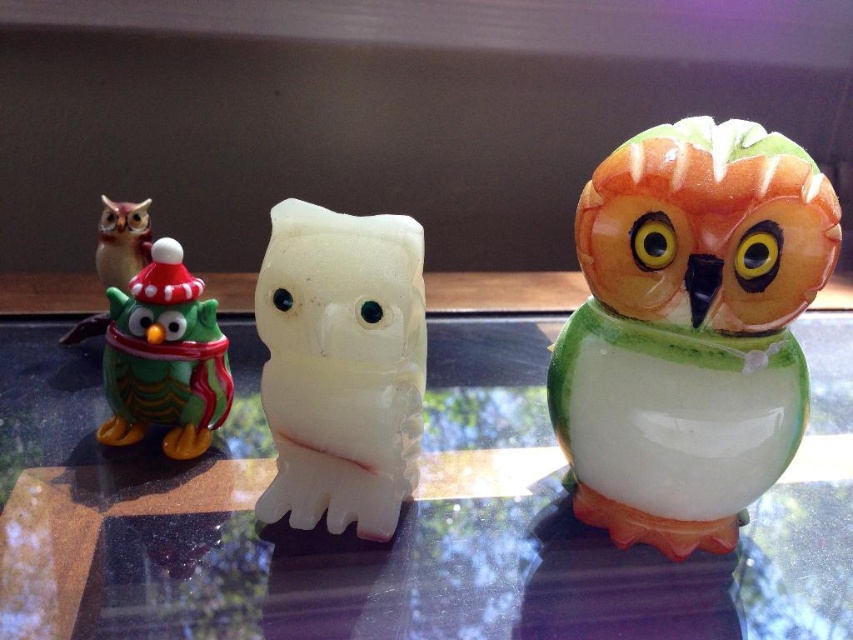
You are a photographer setting up a shot of the white glossy owl at center. You want to ensure the transparent glass table at center is visible in the reflection of the owl. Is the table positioned correctly for this?

The transparent glass table at center is in front of the white glossy owl at center, so the reflection on the owl should show the table beneath it, allowing the photographer to capture the table in the reflection.

You are arranging a display of owls on a shelf and need to ensure that the matte orange owl at right and the matte green owl at left fit side by side. Which owl requires more horizontal space due to its width?

The matte orange owl at right requires more horizontal space because its width surpasses that of the matte green owl at left.

Consider the image. You are a delivery person placing a small package on the transparent glass table at center. The white glossy owl at center is on the table. Will the package be visible from below the table?

The transparent glass table at center has a lesser height compared to white glossy owl at center. Since the table is shorter than the owl, the package placed on the table might be partially visible from below, depending on the table thickness and the package size.